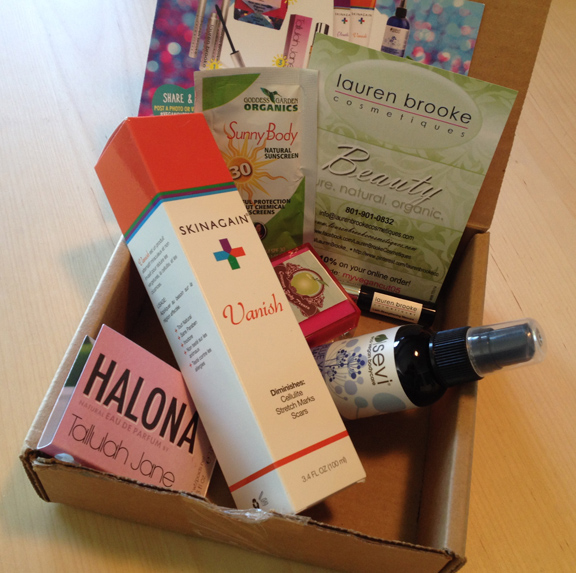
Where is `lid of opened box`? lid of opened box is located at coordinates (516, 79).